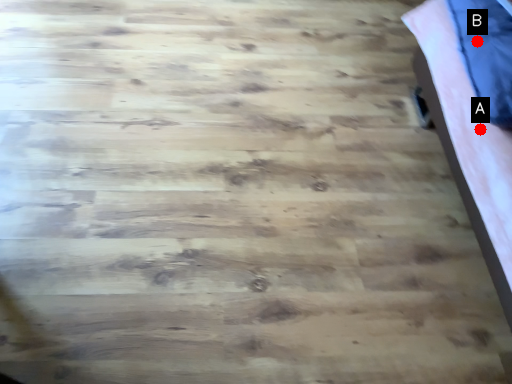
Question: Two points are circled on the image, labeled by A and B beside each circle. Which point appears closest to the camera in this image?

Choices:
 (A) A is closer
 (B) B is closer

Answer: (A)